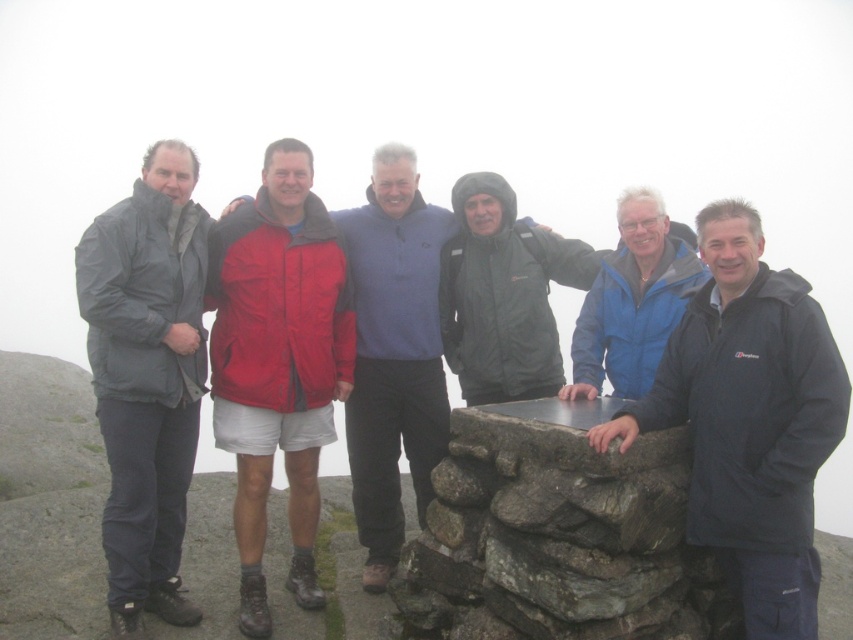
Question: Among these points, which one is farthest from the camera?

Choices:
 (A) (531, 243)
 (B) (720, 381)
 (C) (596, 378)

Answer: (A)

Question: Which of these objects is positioned farthest from the matte black jacket at center?

Choices:
 (A) dark blue jacket at center
 (B) red fabric jacket at center
 (C) blue matte jacket at center

Answer: (A)

Question: Is dark blue jacket at center thinner than red fabric jacket at center?

Choices:
 (A) no
 (B) yes

Answer: (A)

Question: Is red fabric jacket at center to the right of blue matte jacket at center from the viewer's perspective?

Choices:
 (A) yes
 (B) no

Answer: (B)

Question: Is dark blue jacket at center positioned at the back of matte black jacket at center?

Choices:
 (A) no
 (B) yes

Answer: (A)

Question: Among these objects, which one is farthest from the camera?

Choices:
 (A) matte black jacket at center
 (B) red nylon jacket at center
 (C) red fabric jacket at center

Answer: (A)